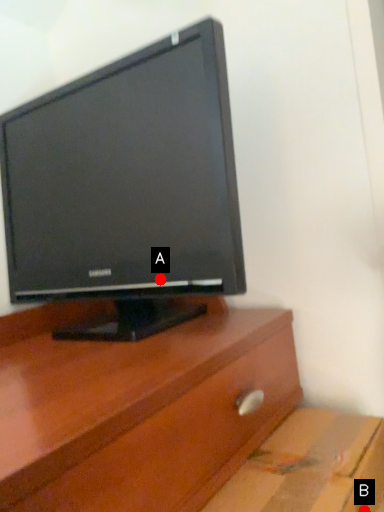
Question: Two points are circled on the image, labeled by A and B beside each circle. Which point is closer to the camera taking this photo?

Choices:
 (A) A is closer
 (B) B is closer

Answer: (B)